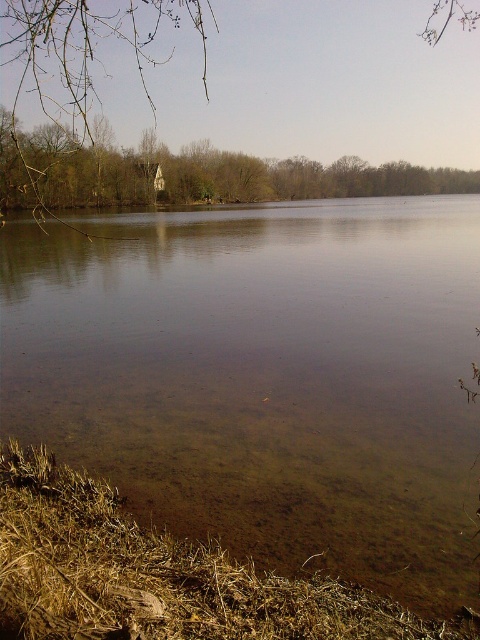
You are standing at the lakeside and see two points marked on the image. The first point is at coordinates point (447, 268) and the second point is at point (58, 220). Which point is closer to you?

Point (447, 268) is in front of point (58, 220), so it is closer to you.